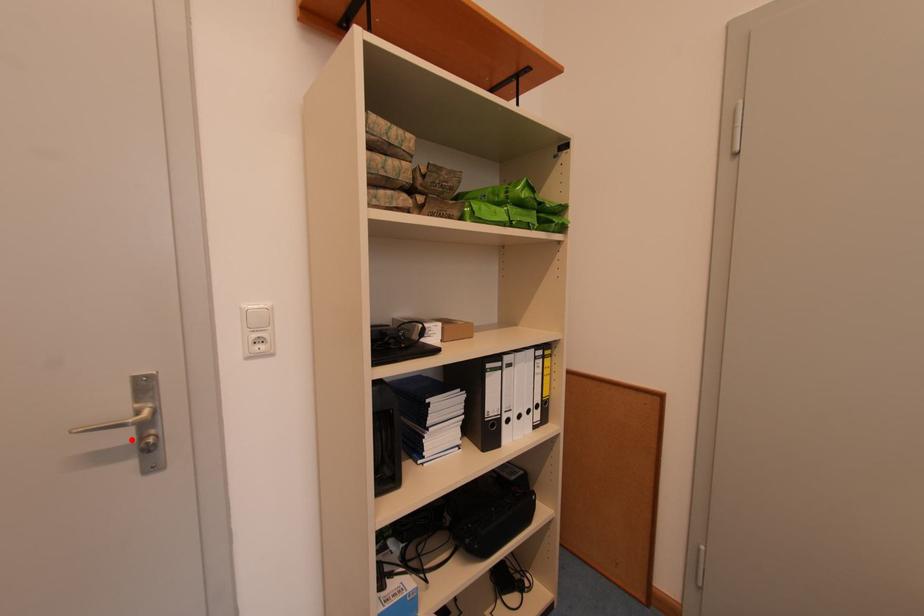
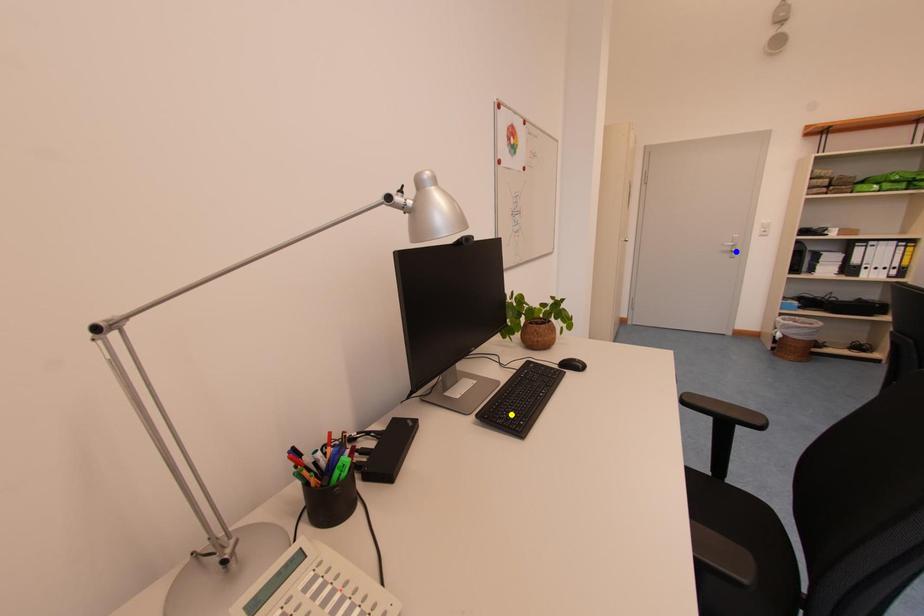
Question: I am providing you with two images of the same scene from different viewpoints. A red point is marked on the first image. You are given multiple points on the second image. Can you choose the point in image 2 that corresponds to the point in image 1?

Choices:
 (A) blue point
 (B) yellow point
 (C) green point

Answer: (A)